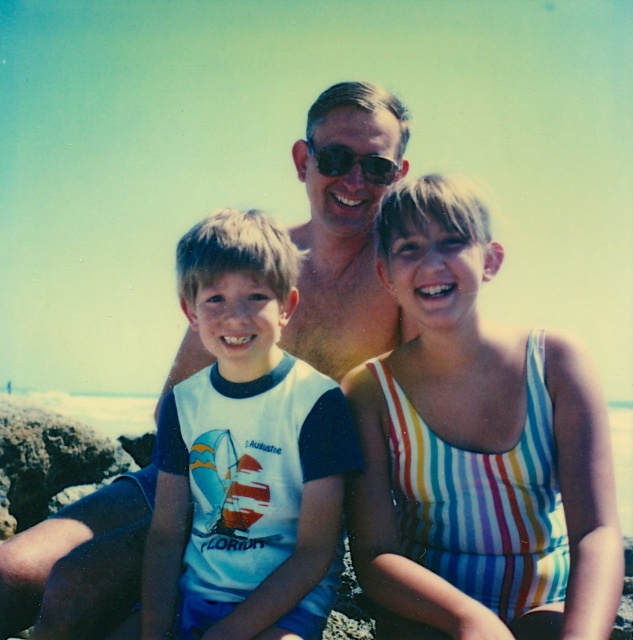
Question: Which object is positioned closest to the white matte t-shirt at center?

Choices:
 (A) black plastic sunglasses at center
 (B) striped fabric swimsuit at center

Answer: (B)

Question: Does striped fabric swimsuit at center have a smaller size compared to black plastic sunglasses at center?

Choices:
 (A) yes
 (B) no

Answer: (B)

Question: Does striped fabric swimsuit at center appear on the right side of white matte t-shirt at center?

Choices:
 (A) yes
 (B) no

Answer: (A)

Question: Does striped fabric swimsuit at center appear under black plastic sunglasses at center?

Choices:
 (A) yes
 (B) no

Answer: (A)

Question: Which of the following is the farthest from the observer?

Choices:
 (A) black plastic sunglasses at center
 (B) white matte t-shirt at center
 (C) striped fabric swimsuit at center

Answer: (A)

Question: Which object appears closest to the camera in this image?

Choices:
 (A) striped fabric swimsuit at center
 (B) white matte t-shirt at center
 (C) black plastic sunglasses at center

Answer: (A)